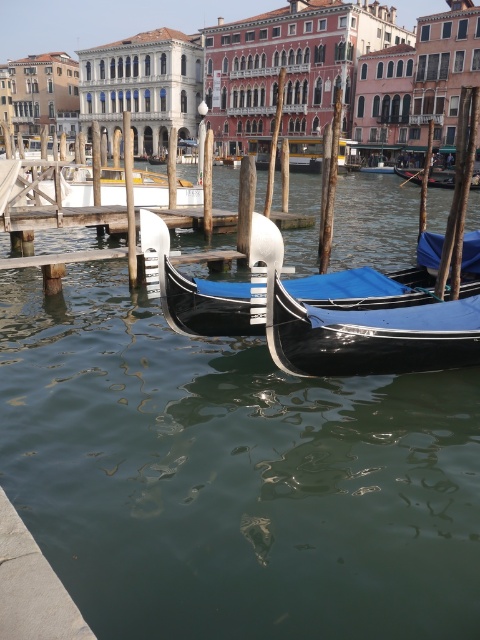
Question: Is wooden gondola at center bigger than blue fabric gondola at center?

Choices:
 (A) no
 (B) yes

Answer: (B)

Question: Which point is farther to the camera?

Choices:
 (A) metallic silver gondola at center
 (B) wooden gondola at center
 (C) shiny black gondola at center

Answer: (A)

Question: Can you confirm if wooden gondola at center is positioned above blue fabric gondola at center?

Choices:
 (A) yes
 (B) no

Answer: (B)

Question: Which object is closer to the camera taking this photo?

Choices:
 (A) blue fabric gondola at center
 (B) metallic silver gondola at center
 (C) shiny black gondola at center
 (D) wooden gondola at center

Answer: (C)

Question: Is shiny black gondola at center below wooden gondola at center?

Choices:
 (A) yes
 (B) no

Answer: (A)

Question: Which point is closer to the camera taking this photo?

Choices:
 (A) (180, 188)
 (B) (444, 177)

Answer: (A)